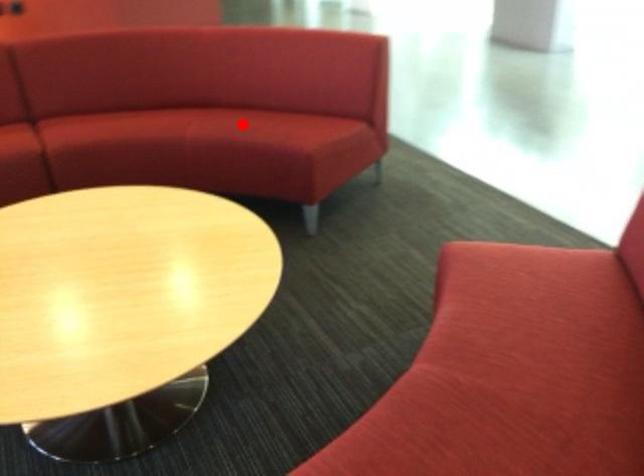
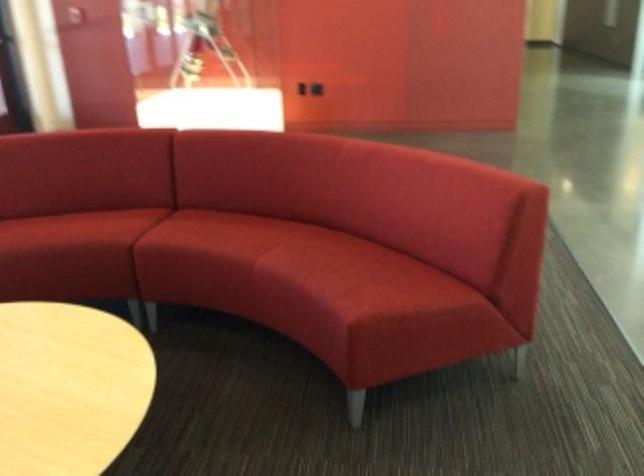
Locate, in the second image, the point that corresponds to the highlighted location in the first image.

(328, 258)